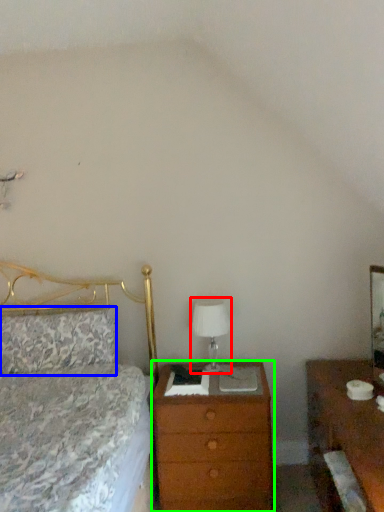
Question: Estimate the real-world distances between objects in this image. Which object is farther from table lamp (highlighted by a red box), pillow (highlighted by a blue box) or chest of drawers (highlighted by a green box)?

Choices:
 (A) pillow
 (B) chest of drawers

Answer: (A)